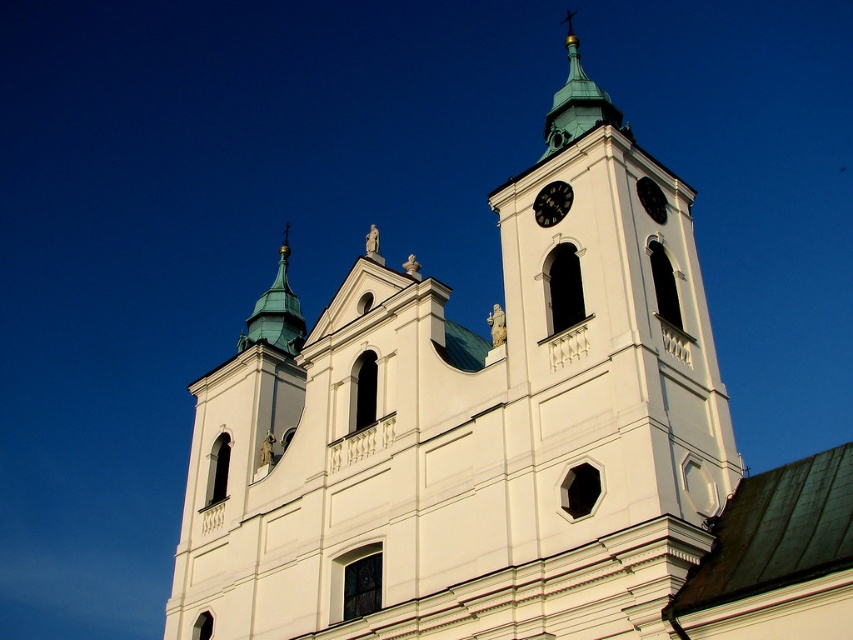
Can you confirm if white stone tower at center is wider than black glossy clock at upper center?

Correct, the width of white stone tower at center exceeds that of black glossy clock at upper center.

Who is lower down, white stone tower at center or black glossy clock at upper center?

white stone tower at center

Which is behind, point (637, 336) or point (561, 195)?

The point (561, 195) is behind.

What are the coordinates of `white stone tower at center` in the screenshot? It's located at (473, 436).

Is green copper spire at upper center behind black glossy clock at upper center?

Yes.

Is green copper spire at upper center shorter than black glossy clock at upper center?

Incorrect, green copper spire at upper center's height does not fall short of black glossy clock at upper center's.

Where is `green copper spire at upper center`? The height and width of the screenshot is (640, 853). green copper spire at upper center is located at coordinates (576, 102).

The width and height of the screenshot is (853, 640). Find the location of `green copper spire at upper center`. green copper spire at upper center is located at coordinates (576, 102).

Can you confirm if white stone tower at center is taller than shiny green spire at upper center?

No, white stone tower at center is not taller than shiny green spire at upper center.

Between point (447, 468) and point (250, 330), which one is positioned in front?

Positioned in front is point (447, 468).

I want to click on white stone tower at center, so click(473, 436).